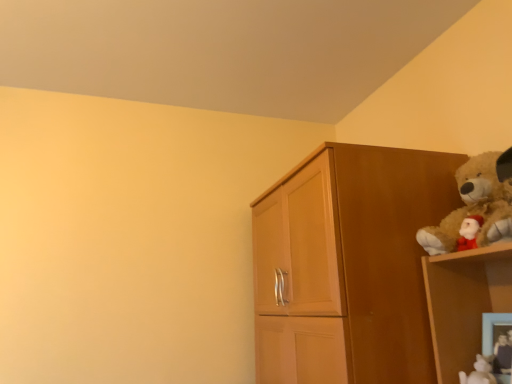
What is the approximate width of fuzzy brown teddy bear at upper right?

It is 12.10 inches.

Looking at this image, measure the distance between velvety plush bear at upper right, the second toy in the left-to-right sequence, and camera.

1.08 meters.

The width and height of the screenshot is (512, 384). What do you see at coordinates (353, 257) in the screenshot?
I see `wooden cupboard at right` at bounding box center [353, 257].

What do you see at coordinates (498, 343) in the screenshot?
I see `wooden picture frame at lower right` at bounding box center [498, 343].

Locate an element on the screen. The width and height of the screenshot is (512, 384). white glossy figurine at lower right, the first toy viewed from the left is located at coordinates (479, 372).

The width and height of the screenshot is (512, 384). Find the location of `fuzzy brown teddy bear at upper right`. fuzzy brown teddy bear at upper right is located at coordinates (476, 207).

Is fuzzy brown teddy bear at upper right further to camera compared to white glossy figurine at lower right, the first toy viewed from the left?

That is False.

From a real-world perspective, who is located lower, fuzzy brown teddy bear at upper right or white glossy figurine at lower right, the first toy viewed from the left?

white glossy figurine at lower right, the first toy viewed from the left.

Who is shorter, fuzzy brown teddy bear at upper right or white glossy figurine at lower right, the 2th toy positioned from the right?

white glossy figurine at lower right, the 2th toy positioned from the right, is shorter.

Is fuzzy brown teddy bear at upper right at the left side of white glossy figurine at lower right, the 2th toy positioned from the right?

Incorrect, fuzzy brown teddy bear at upper right is not on the left side of white glossy figurine at lower right, the 2th toy positioned from the right.

From the picture: From a real-world perspective, is fuzzy brown teddy bear at upper right located higher than wooden cupboard at right?

Correct, in the physical world, fuzzy brown teddy bear at upper right is higher than wooden cupboard at right.

From the image's perspective, does fuzzy brown teddy bear at upper right appear lower than wooden cupboard at right?

No, from the image's perspective, fuzzy brown teddy bear at upper right is not beneath wooden cupboard at right.

Is fuzzy brown teddy bear at upper right completely or partially outside of wooden cupboard at right?

Yes, fuzzy brown teddy bear at upper right is not within wooden cupboard at right.

Considering the sizes of fuzzy brown teddy bear at upper right and wooden cupboard at right in the image, is fuzzy brown teddy bear at upper right wider or thinner than wooden cupboard at right?

Clearly, fuzzy brown teddy bear at upper right has less width compared to wooden cupboard at right.

Does fuzzy brown teddy bear at upper right contain velvety plush bear at upper right, acting as the first toy starting from the right?

No, velvety plush bear at upper right, acting as the first toy starting from the right, is not surrounded by fuzzy brown teddy bear at upper right.

Is fuzzy brown teddy bear at upper right smaller than velvety plush bear at upper right, acting as the first toy starting from the right?

No, fuzzy brown teddy bear at upper right is not smaller than velvety plush bear at upper right, acting as the first toy starting from the right.

Would you say fuzzy brown teddy bear at upper right is a long distance from velvety plush bear at upper right, acting as the first toy starting from the right?

fuzzy brown teddy bear at upper right is near velvety plush bear at upper right, acting as the first toy starting from the right, not far away.

From the image's perspective, does fuzzy brown teddy bear at upper right appear lower than velvety plush bear at upper right, acting as the first toy starting from the right?

Incorrect, from the image's perspective, fuzzy brown teddy bear at upper right is higher than velvety plush bear at upper right, acting as the first toy starting from the right.

From the picture: Is velvety plush bear at upper right, acting as the first toy starting from the right, with wooden cupboard at right?

velvety plush bear at upper right, acting as the first toy starting from the right, and wooden cupboard at right are clearly separated.

Considering the points (505, 341) and (362, 288), which point is behind, point (505, 341) or point (362, 288)?

The point (362, 288) is farther from the camera.

Would you say wooden cupboard at right is part of velvety plush bear at upper right, acting as the first toy starting from the right,'s contents?

No, wooden cupboard at right is not surrounded by velvety plush bear at upper right, acting as the first toy starting from the right.

Considering the relative positions of velvety plush bear at upper right, acting as the first toy starting from the right, and wooden cupboard at right in the image provided, is velvety plush bear at upper right, acting as the first toy starting from the right, behind wooden cupboard at right?

No, velvety plush bear at upper right, acting as the first toy starting from the right, is closer to the viewer.

Is wooden picture frame at lower right positioned far away from white glossy figurine at lower right, the first toy viewed from the left?

Actually, wooden picture frame at lower right and white glossy figurine at lower right, the first toy viewed from the left, are a little close together.

In the scene shown: From the image's perspective, is wooden picture frame at lower right located beneath white glossy figurine at lower right, the 2th toy positioned from the right?

No.

Is wooden picture frame at lower right outside of white glossy figurine at lower right, the first toy viewed from the left?

Yes.

Could you tell me if wooden picture frame at lower right is facing white glossy figurine at lower right, the 2th toy positioned from the right?

Yes, wooden picture frame at lower right faces towards white glossy figurine at lower right, the 2th toy positioned from the right.

In terms of height, does velvety plush bear at upper right, the second toy in the left-to-right sequence, look taller or shorter compared to fuzzy brown teddy bear at upper right?

In the image, velvety plush bear at upper right, the second toy in the left-to-right sequence, appears to be shorter than fuzzy brown teddy bear at upper right.

From a real-world perspective, relative to fuzzy brown teddy bear at upper right, is velvety plush bear at upper right, acting as the first toy starting from the right, vertically above or below?

Clearly, from a real-world perspective, velvety plush bear at upper right, acting as the first toy starting from the right, is below fuzzy brown teddy bear at upper right.

Locate an element on the screen. Image resolution: width=512 pixels, height=384 pixels. toy to the right of fuzzy brown teddy bear at upper right is located at coordinates (502, 349).

Is velvety plush bear at upper right, the second toy in the left-to-right sequence, positioned with its back to wooden picture frame at lower right?

No, velvety plush bear at upper right, the second toy in the left-to-right sequence, is not facing the opposite direction of wooden picture frame at lower right.

From a real-world perspective, is velvety plush bear at upper right, the second toy in the left-to-right sequence, located beneath wooden picture frame at lower right?

Correct, in the physical world, velvety plush bear at upper right, the second toy in the left-to-right sequence, is lower than wooden picture frame at lower right.

Is velvety plush bear at upper right, the second toy in the left-to-right sequence, positioned before wooden picture frame at lower right?

Yes, it is in front of wooden picture frame at lower right.

Considering the sizes of velvety plush bear at upper right, the second toy in the left-to-right sequence, and wooden picture frame at lower right in the image, is velvety plush bear at upper right, the second toy in the left-to-right sequence, bigger or smaller than wooden picture frame at lower right?

velvety plush bear at upper right, the second toy in the left-to-right sequence, is bigger than wooden picture frame at lower right.

You are a GUI agent. You are given a task and a screenshot of the screen. Output one action in this format:
    pyautogui.click(x=<x>, y=<y>)
    Task: Click on the toy behind the fuzzy brown teddy bear at upper right
    Image resolution: width=512 pixels, height=384 pixels.
    Given the screenshot: What is the action you would take?
    pyautogui.click(x=479, y=372)

Locate an element on the screen. teddy bear that appears above the wooden cupboard at right (from a real-world perspective) is located at coordinates (476, 207).

From the image, which object appears to be farther from wooden picture frame at lower right, velvety plush bear at upper right, acting as the first toy starting from the right, or fuzzy brown teddy bear at upper right?

fuzzy brown teddy bear at upper right lies further to wooden picture frame at lower right than the other object.

Consider the image. Considering their positions, is velvety plush bear at upper right, the second toy in the left-to-right sequence, positioned further to wooden cupboard at right than fuzzy brown teddy bear at upper right?

velvety plush bear at upper right, the second toy in the left-to-right sequence, lies further to wooden cupboard at right than the other object.

Based on their spatial positions, is wooden cupboard at right or wooden picture frame at lower right further from fuzzy brown teddy bear at upper right?

The object further to fuzzy brown teddy bear at upper right is wooden picture frame at lower right.

Based on their spatial positions, is wooden cupboard at right or velvety plush bear at upper right, acting as the first toy starting from the right, further from fuzzy brown teddy bear at upper right?

Based on the image, velvety plush bear at upper right, acting as the first toy starting from the right, appears to be further to fuzzy brown teddy bear at upper right.

From the image, which object appears to be nearer to fuzzy brown teddy bear at upper right, wooden picture frame at lower right or velvety plush bear at upper right, acting as the first toy starting from the right?

Among the two, wooden picture frame at lower right is located nearer to fuzzy brown teddy bear at upper right.

When comparing their distances from white glossy figurine at lower right, the 2th toy positioned from the right, does fuzzy brown teddy bear at upper right or wooden cupboard at right seem further?

wooden cupboard at right is positioned further to the anchor white glossy figurine at lower right, the 2th toy positioned from the right.

Based on their spatial positions, is wooden cupboard at right or white glossy figurine at lower right, the 2th toy positioned from the right, closer to fuzzy brown teddy bear at upper right?

wooden cupboard at right.

Looking at the image, which one is located further to wooden cupboard at right, white glossy figurine at lower right, the first toy viewed from the left, or fuzzy brown teddy bear at upper right?

white glossy figurine at lower right, the first toy viewed from the left, is positioned further to the anchor wooden cupboard at right.

The height and width of the screenshot is (384, 512). In order to click on toy between fuzzy brown teddy bear at upper right and white glossy figurine at lower right, the first toy viewed from the left, from top to bottom in this screenshot , I will do `click(502, 349)`.

The width and height of the screenshot is (512, 384). Find the location of `cupboard between fuzzy brown teddy bear at upper right and wooden picture frame at lower right from top to bottom`. cupboard between fuzzy brown teddy bear at upper right and wooden picture frame at lower right from top to bottom is located at coordinates (353, 257).

Locate an element on the screen. Image resolution: width=512 pixels, height=384 pixels. picture frame between white glossy figurine at lower right, the 2th toy positioned from the right, and velvety plush bear at upper right, the second toy in the left-to-right sequence is located at coordinates (498, 343).

At what (x,y) coordinates should I click in order to perform the action: click on toy between fuzzy brown teddy bear at upper right and wooden picture frame at lower right vertically. Please return your answer as a coordinate pair (x, y). Image resolution: width=512 pixels, height=384 pixels. Looking at the image, I should click on (502, 349).